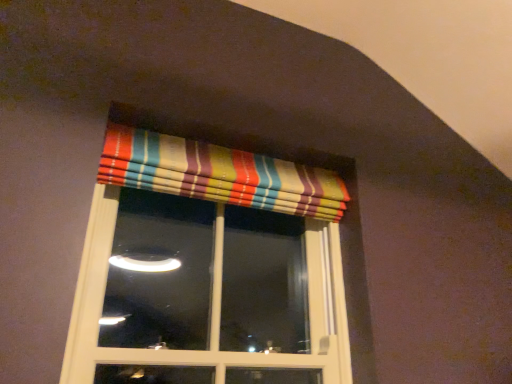
Question: Is striped fabric curtain at upper center taller or shorter than striped fabric valance at upper center?

Choices:
 (A) short
 (B) tall

Answer: (A)

Question: Is striped fabric curtain at upper center in front of or behind striped fabric valance at upper center in the image?

Choices:
 (A) front
 (B) behind

Answer: (B)

Question: Is point (110, 175) closer or farther from the camera than point (309, 274)?

Choices:
 (A) closer
 (B) farther

Answer: (A)

Question: In the image, is striped fabric valance at upper center positioned in front of or behind striped fabric curtain at upper center?

Choices:
 (A) front
 (B) behind

Answer: (A)

Question: From a real-world perspective, relative to striped fabric curtain at upper center, is striped fabric valance at upper center vertically above or below?

Choices:
 (A) above
 (B) below

Answer: (B)

Question: From the image's perspective, is striped fabric valance at upper center positioned above or below striped fabric curtain at upper center?

Choices:
 (A) above
 (B) below

Answer: (B)

Question: Is striped fabric valance at upper center bigger or smaller than striped fabric curtain at upper center?

Choices:
 (A) big
 (B) small

Answer: (A)